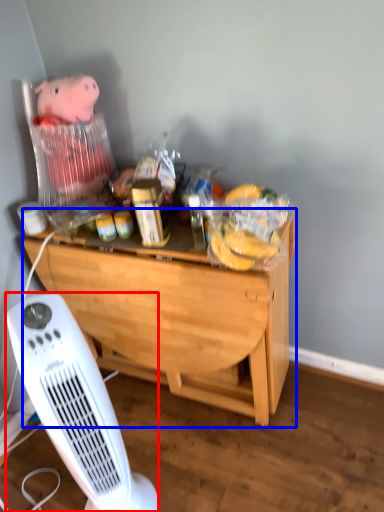
Question: Which object is further to the camera taking this photo, home appliance (highlighted by a red box) or desk (highlighted by a blue box)?

Choices:
 (A) home appliance
 (B) desk

Answer: (B)